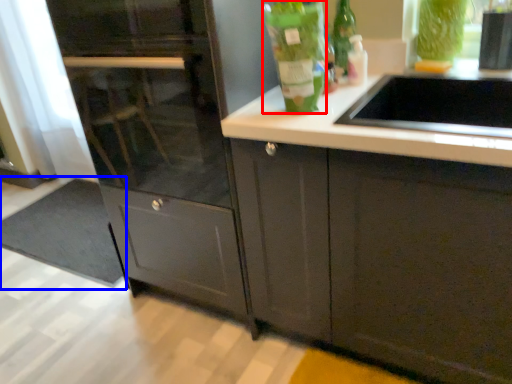
Question: Among these objects, which one is farthest to the camera, bottle (highlighted by a red box) or doormat (highlighted by a blue box)?

Choices:
 (A) bottle
 (B) doormat

Answer: (B)